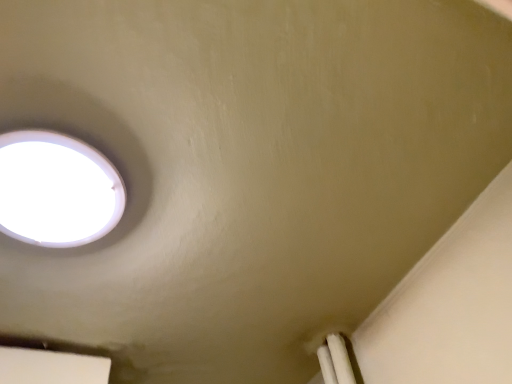
This screenshot has height=384, width=512. I want to click on white glossy window at upper left, so click(56, 190).

This screenshot has height=384, width=512. What do you see at coordinates (56, 190) in the screenshot?
I see `white glossy window at upper left` at bounding box center [56, 190].

At what (x,y) coordinates should I click in order to perform the action: click on white glossy window at upper left. Please return your answer as a coordinate pair (x, y). This screenshot has width=512, height=384. Looking at the image, I should click on (56, 190).